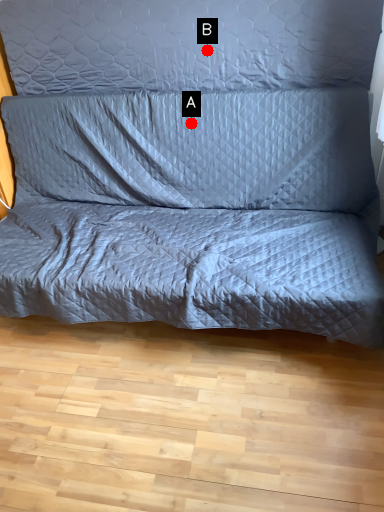
Question: Two points are circled on the image, labeled by A and B beside each circle. Which point is further to the camera?

Choices:
 (A) A is further
 (B) B is further

Answer: (A)